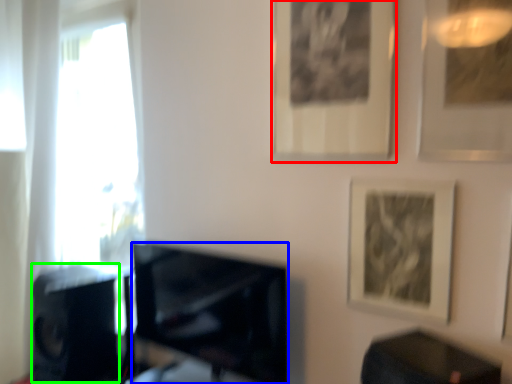
Question: Based on their relative distances, which object is farther from picture frame (highlighted by a red box)? Choose from television (highlighted by a blue box) and speaker (highlighted by a green box).

Choices:
 (A) television
 (B) speaker

Answer: (B)